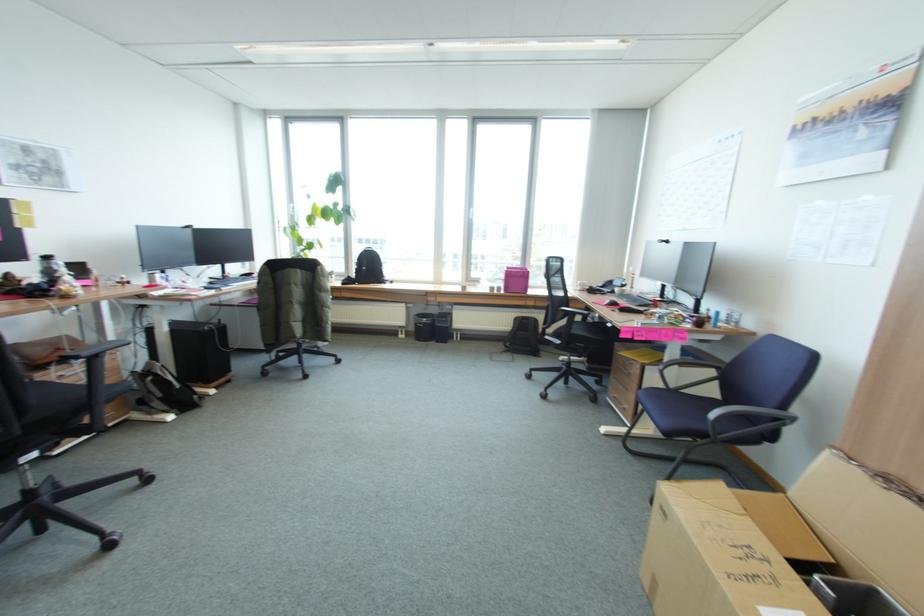
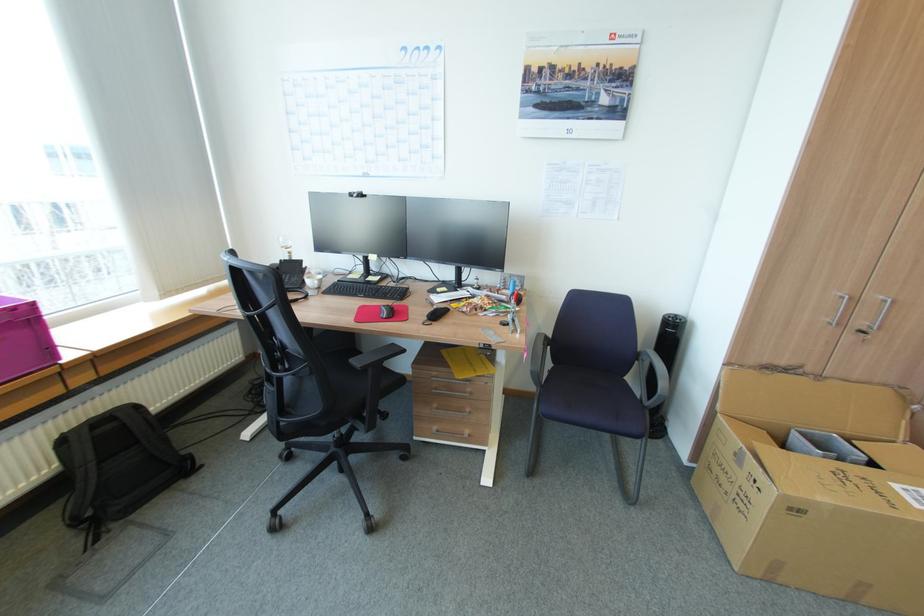
Where in the second image is the point corresponding to (x=520, y=318) from the first image?

(68, 440)